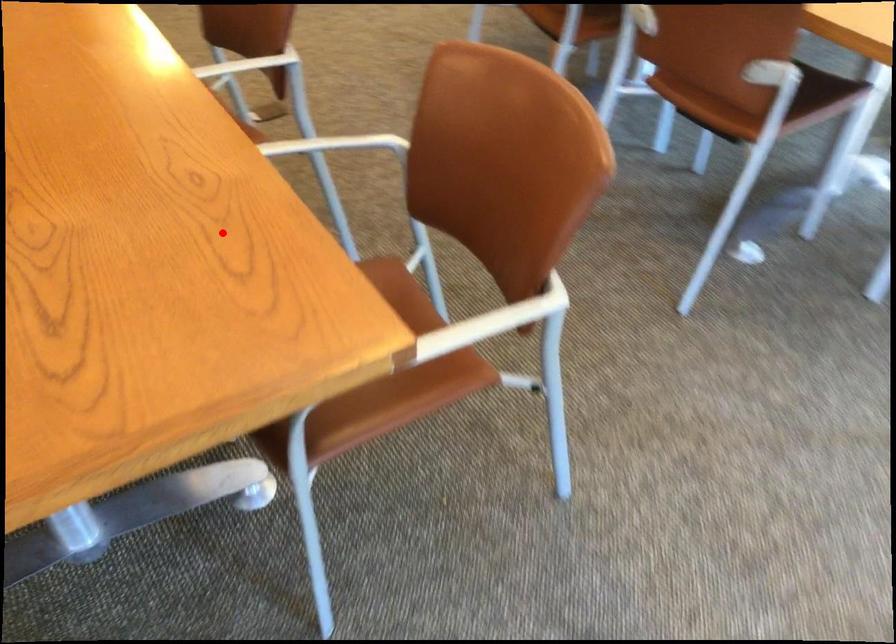
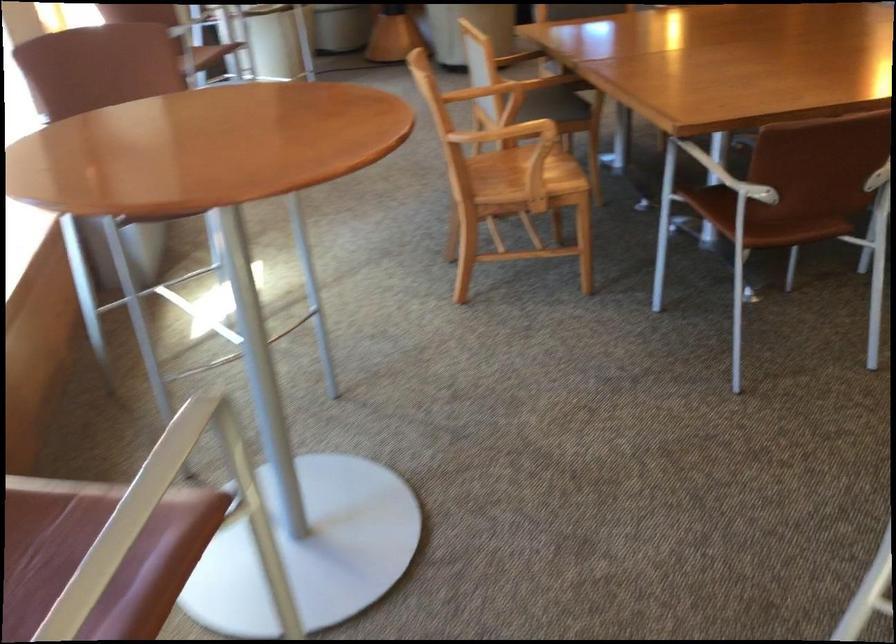
Where in the second image is the point corresponding to the highlighted location from the first image?

(728, 176)